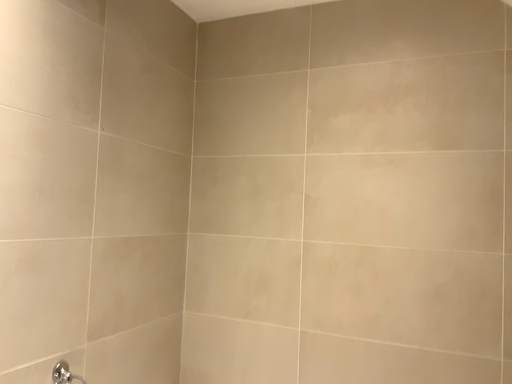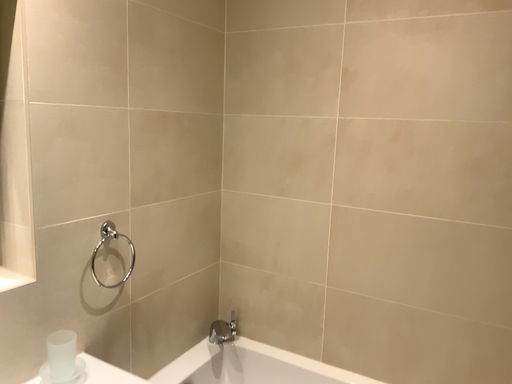
Question: Which way did the camera rotate in the video?

Choices:
 (A) rotated right
 (B) rotated left

Answer: (B)